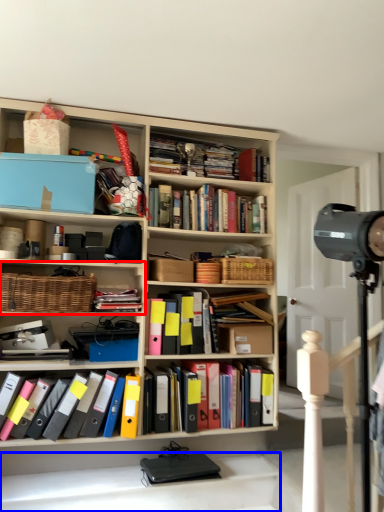
Question: Which of the following is the closest to the observer, shelf (highlighted by a red box) or stairwell (highlighted by a blue box)?

Choices:
 (A) shelf
 (B) stairwell

Answer: (B)